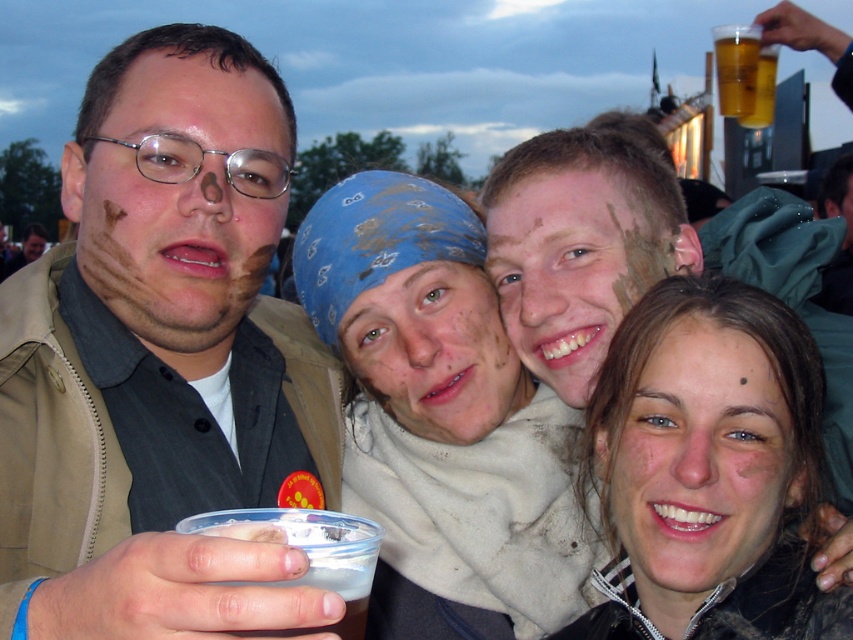
Which of these two, matte brown face at left or matte skin face at center, stands shorter?

Standing shorter between the two is matte skin face at center.

Does matte brown face at left lie in front of matte skin face at center?

Yes.

Is point (271, 132) positioned behind point (352, 333)?

No, it is not.

This screenshot has height=640, width=853. What are the coordinates of `matte brown face at left` in the screenshot? It's located at (167, 244).

Identify the location of matte skin face at lower right. (699, 461).

Does matte skin face at lower right have a greater height compared to matte skin face at center?

Yes, matte skin face at lower right is taller than matte skin face at center.

Who is more distant from viewer, [778,451] or [451,340]?

Positioned behind is point [451,340].

Image resolution: width=853 pixels, height=640 pixels. In order to click on matte skin face at lower right in this screenshot , I will do `click(699, 461)`.

Is matte black jacket at lower right positioned in front of translucent plastic cup at upper right?

Yes, matte black jacket at lower right is in front of translucent plastic cup at upper right.

Does point (659, 460) come farther from viewer compared to point (746, 72)?

No, (659, 460) is in front of (746, 72).

Locate an element on the screen. matte black jacket at lower right is located at coordinates (711, 467).